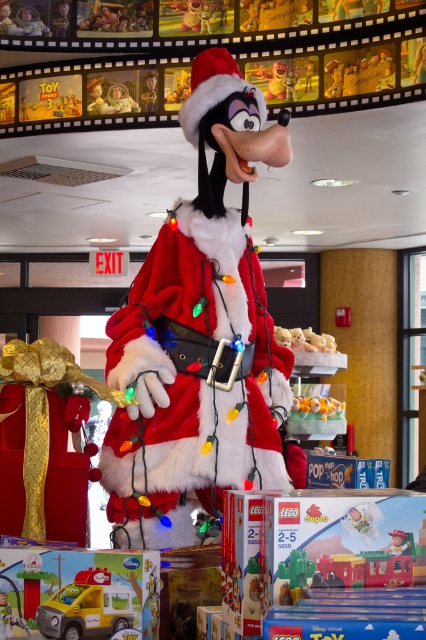
Is fuzzy red santa claus at center above velvet red gift at center?

Yes.

Is fuzzy red santa claus at center thinner than velvet red gift at center?

No, fuzzy red santa claus at center is not thinner than velvet red gift at center.

Between point (224, 188) and point (40, 433), which one is positioned in front?

Point (40, 433)

Image resolution: width=426 pixels, height=640 pixels. Identify the location of fuzzy red santa claus at center. (199, 336).

Between velvet red gift at center and yellow rubber duck at center, which one has more height?

velvet red gift at center

Is point (3, 364) farther from viewer compared to point (310, 412)?

No, (3, 364) is in front of (310, 412).

The height and width of the screenshot is (640, 426). Identify the location of velvet red gift at center. (46, 440).

Identify the location of velvet red gift at center. This screenshot has width=426, height=640. coord(46,440).

Is yellow plastic toy truck at lower left below plush yellow bear at center?

Correct, yellow plastic toy truck at lower left is located below plush yellow bear at center.

Between yellow plastic toy truck at lower left and plush yellow bear at center, which one has more height?

plush yellow bear at center

Is point (51, 618) positioned in front of point (270, 93)?

Yes.

At what (x,y) coordinates should I click in order to perform the action: click on yellow plastic toy truck at lower left. Please return your answer as a coordinate pair (x, y). This screenshot has height=640, width=426. Looking at the image, I should click on (86, 605).